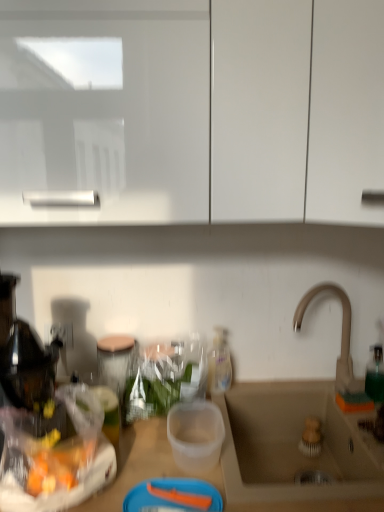
Find the location of `vacant space to the right of translucent plastic bottle at center`. vacant space to the right of translucent plastic bottle at center is located at coordinates (265, 389).